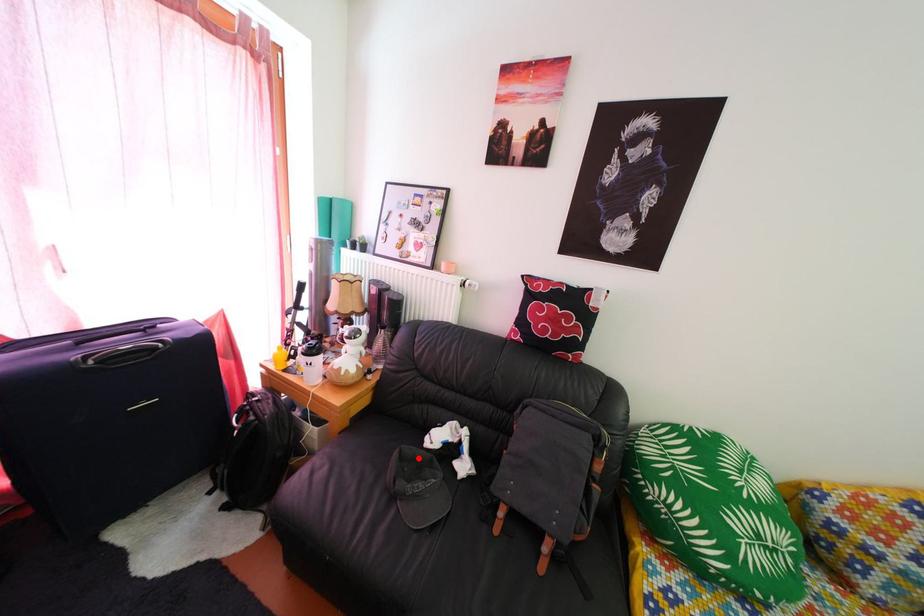
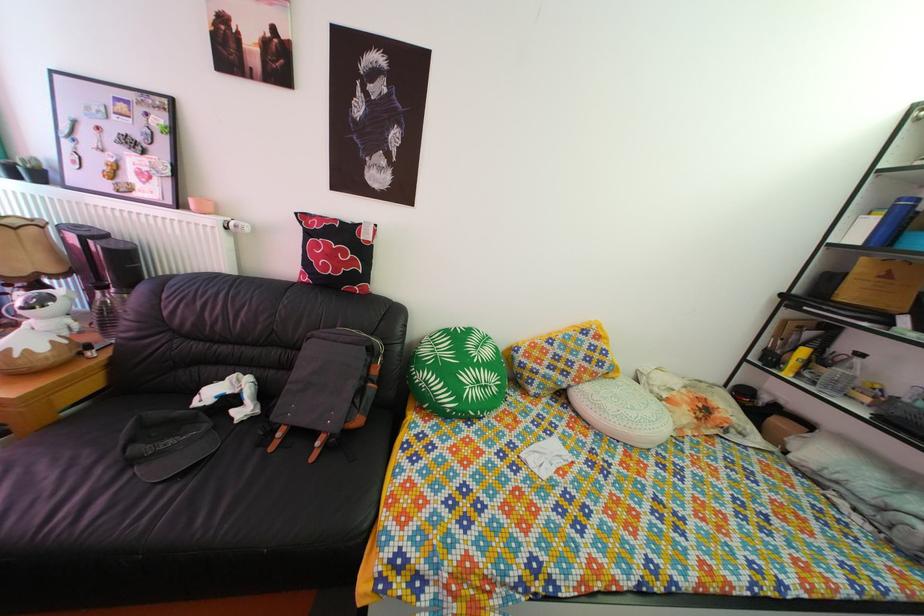
In the second image, find the point that corresponds to the highlighted location in the first image.

(166, 422)